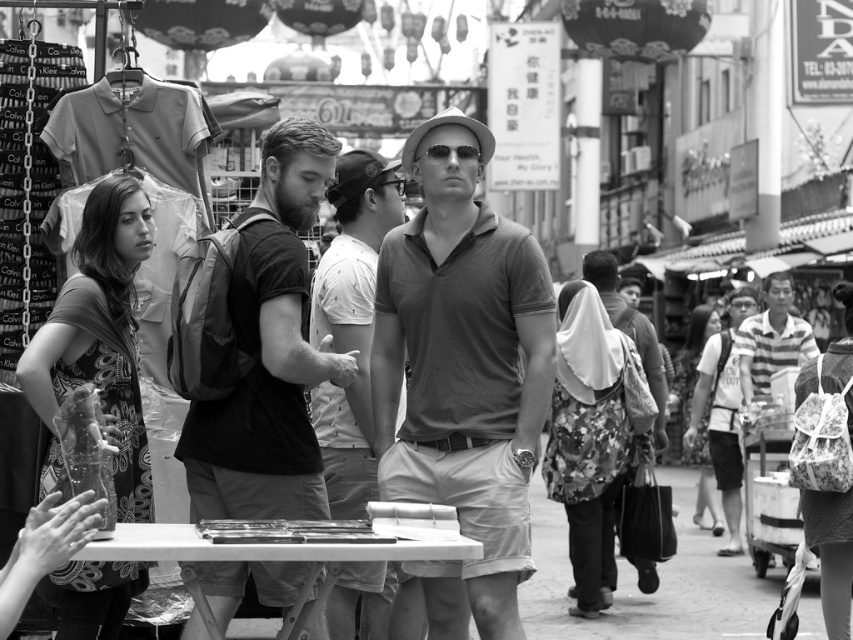
Does patterned fabric dress at left have a lesser width compared to floral fabric bag at center-right?

Yes.

Which is more to the right, patterned fabric dress at left or floral fabric bag at center-right?

From the viewer's perspective, floral fabric bag at center-right appears more on the right side.

What do you see at coordinates (100, 333) in the screenshot? The image size is (853, 640). I see `patterned fabric dress at left` at bounding box center [100, 333].

You are a GUI agent. You are given a task and a screenshot of the screen. Output one action in this format:
    pyautogui.click(x=<x>, y=<y>)
    Task: Click on the patterned fabric dress at left
    
    Given the screenshot: What is the action you would take?
    pyautogui.click(x=100, y=333)

Is striped cotton shirt at right positioned in front of floral fabric bag at center-right?

Yes.

Between striped cotton shirt at right and floral fabric bag at center-right, which one has less height?

With less height is floral fabric bag at center-right.

Identify the location of striped cotton shirt at right. (722, 412).

Image resolution: width=853 pixels, height=640 pixels. What are the coordinates of `striped cotton shirt at right` in the screenshot? It's located at (722, 412).

Does smooth gray shirt at center appear over striped cotton shirt at right?

Indeed, smooth gray shirt at center is positioned over striped cotton shirt at right.

Consider the image. Does smooth gray shirt at center have a smaller size compared to striped cotton shirt at right?

Yes, smooth gray shirt at center is smaller than striped cotton shirt at right.

At what (x,y) coordinates should I click in order to perform the action: click on smooth gray shirt at center. Please return your answer as a coordinate pair (x, y). This screenshot has width=853, height=640. Looking at the image, I should click on (351, 323).

Locate an element on the screen. This screenshot has width=853, height=640. smooth gray shirt at center is located at coordinates (351, 323).